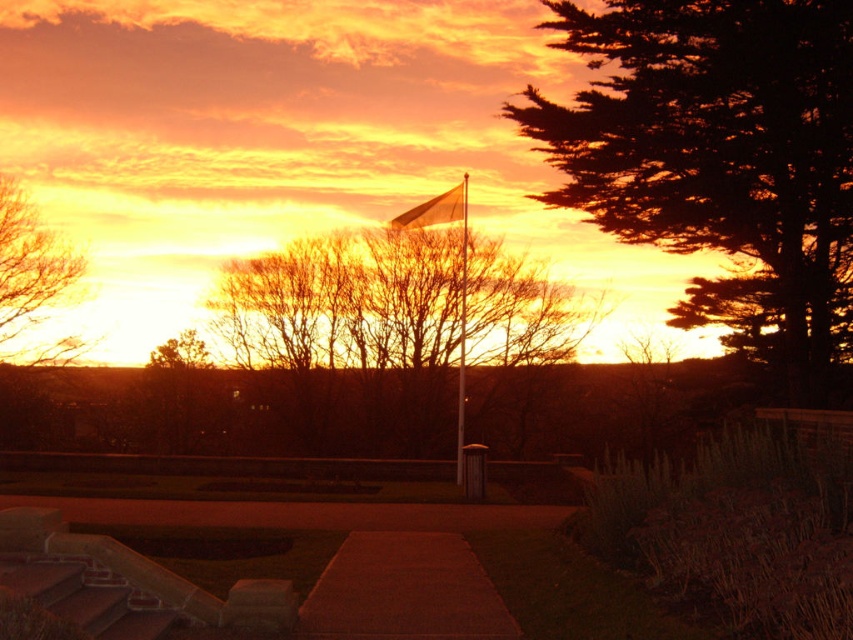
Is silhouette evergreen tree at right to the right of metallic flag pole at center from the viewer's perspective?

Yes, silhouette evergreen tree at right is to the right of metallic flag pole at center.

In the scene shown: Is silhouette evergreen tree at right positioned before metallic flag pole at center?

Yes, it is in front of metallic flag pole at center.

Is point (682, 13) closer to viewer compared to point (465, 273)?

That is True.

The width and height of the screenshot is (853, 640). What are the coordinates of `silhouette evergreen tree at right` in the screenshot? It's located at pos(720,160).

Can you confirm if smooth brown mat at center is wider than metallic flag pole at center?

Indeed, smooth brown mat at center has a greater width compared to metallic flag pole at center.

Which is behind, point (427, 576) or point (463, 211)?

The point (463, 211) is more distant.

Is point (389, 616) positioned behind point (461, 195)?

No, it is in front of (461, 195).

Image resolution: width=853 pixels, height=640 pixels. Identify the location of smooth brown mat at center. (404, 592).

Measure the distance from smooth brown mat at center to brown leafless tree at upper left.

smooth brown mat at center is 26.96 meters from brown leafless tree at upper left.

Based on the photo, is smooth brown mat at center to the right of brown leafless tree at upper left from the viewer's perspective?

Indeed, smooth brown mat at center is positioned on the right side of brown leafless tree at upper left.

Between point (492, 595) and point (51, 358), which one is positioned behind?

Positioned behind is point (51, 358).

This screenshot has width=853, height=640. I want to click on smooth brown mat at center, so click(x=404, y=592).